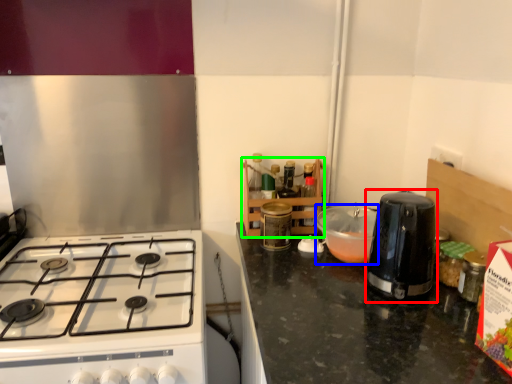
Question: Based on their relative distances, which object is nearer to kitchen appliance (highlighted by a red box)? Choose from kitchen appliance (highlighted by a blue box) and shelf (highlighted by a green box).

Choices:
 (A) kitchen appliance
 (B) shelf

Answer: (A)